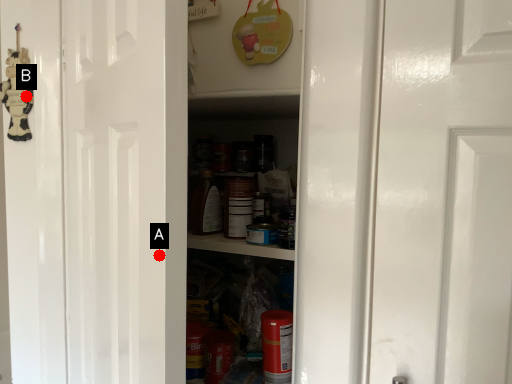
Question: Two points are circled on the image, labeled by A and B beside each circle. Which point is farther from the camera taking this photo?

Choices:
 (A) A is further
 (B) B is further

Answer: (B)